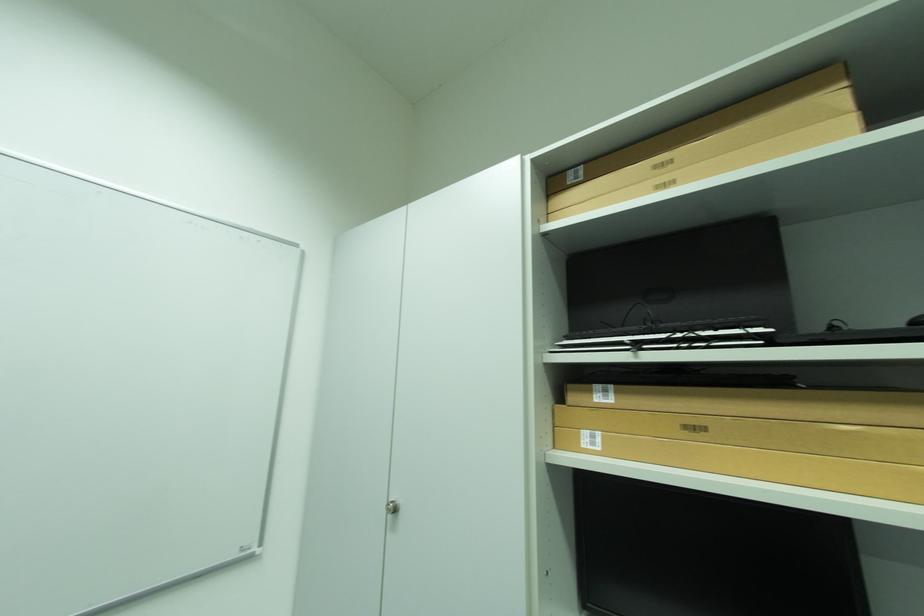
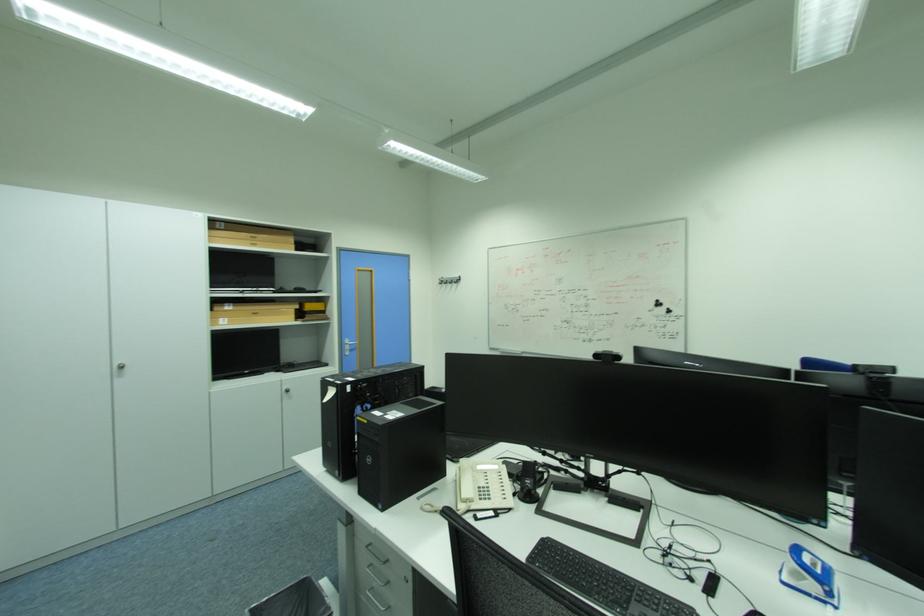
Where in the second image is the point corresponding to [593,434] from the first image?

(228, 320)